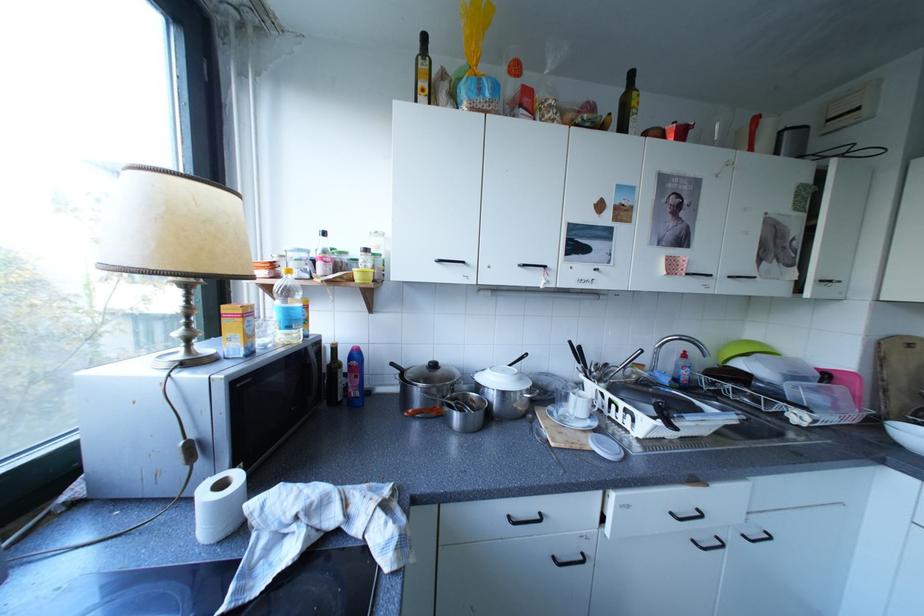
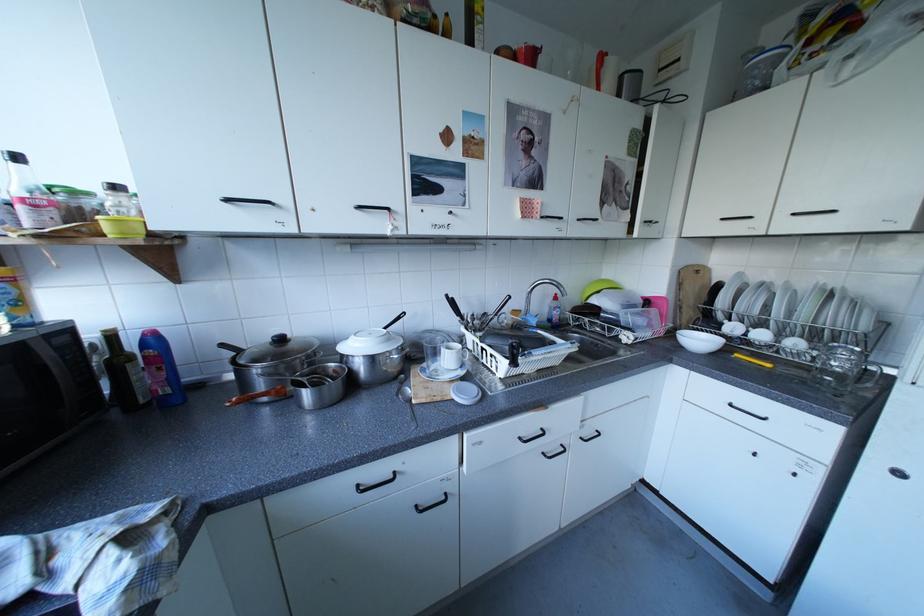
Locate, in the second image, the point that corresponds to the point at 574,411 in the first image.

(445, 367)